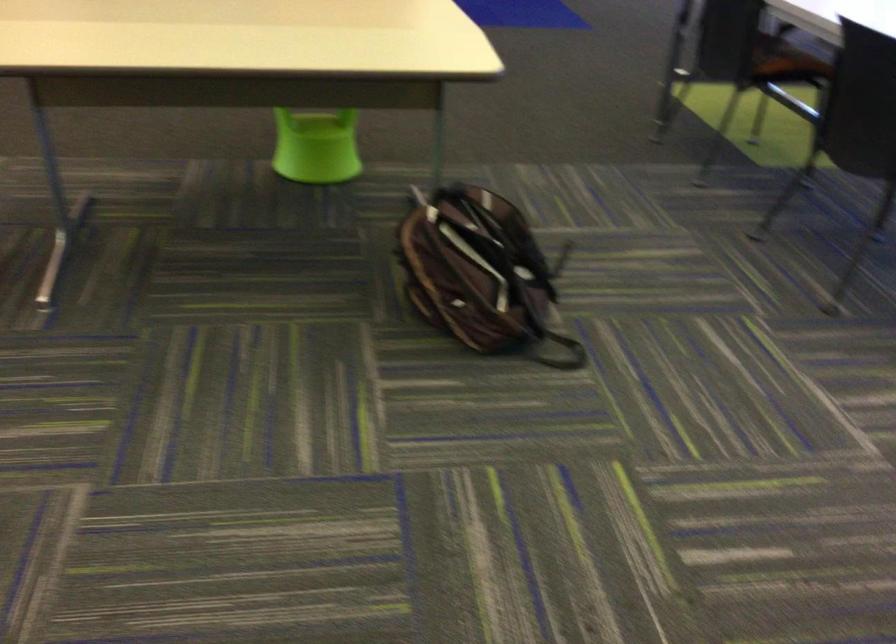
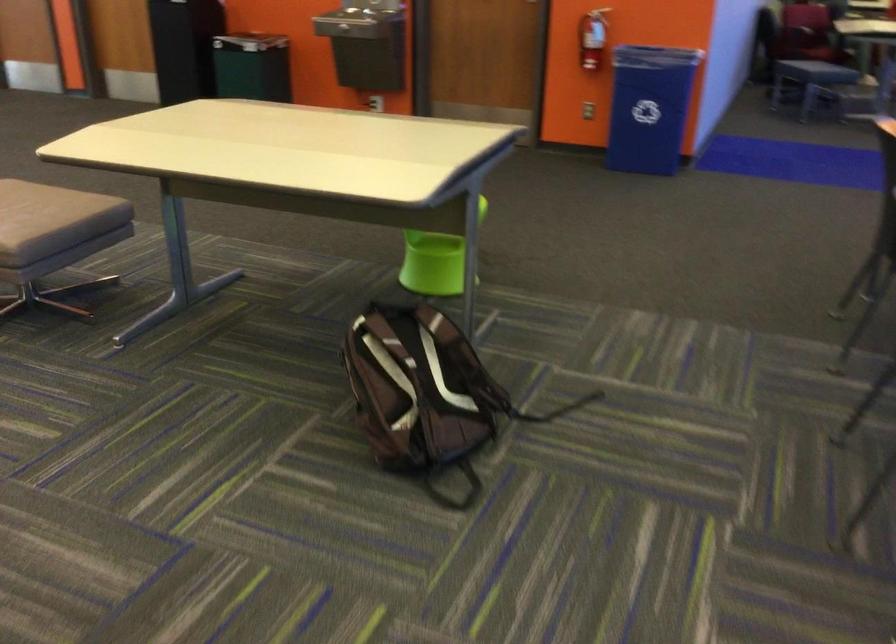
In the second image, find the point that corresponds to (510,269) in the first image.

(419, 392)